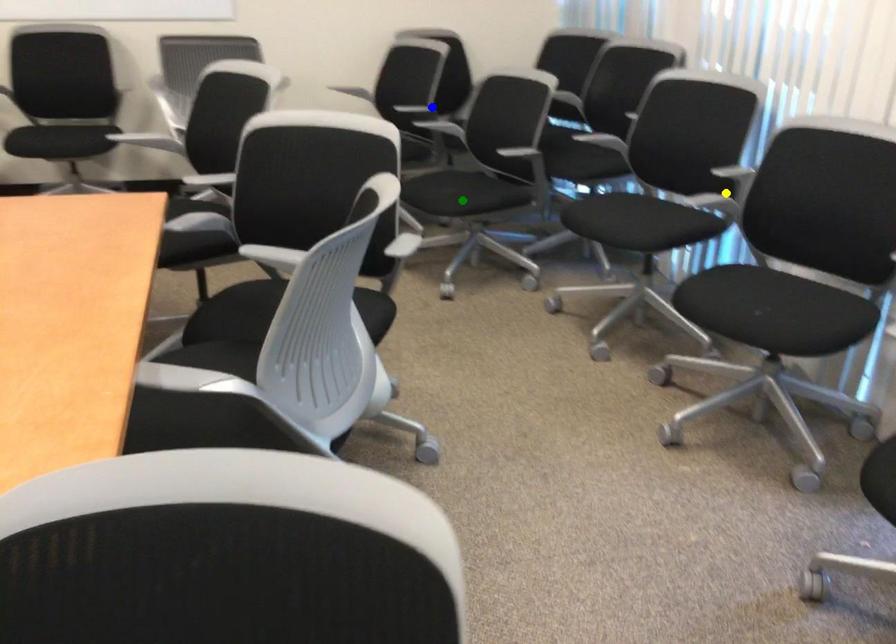
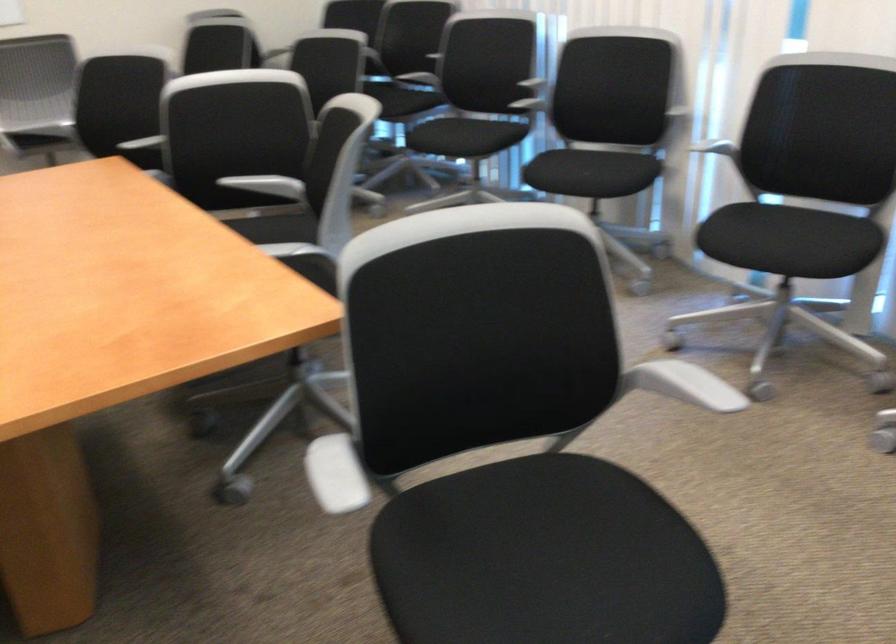
I am providing you with two images of the same scene from different viewpoints. Three points are marked in image1. Which point corresponds to a part or object that is occluded in image2?In image1, three points are marked. Which of them correspond to a part or object that is occluded in image2?Among the three points shown in image1, which one corresponds to a part or object that is no longer visible due to occlusion in image2?

Invisible in image2: blue point, green point, yellow point.